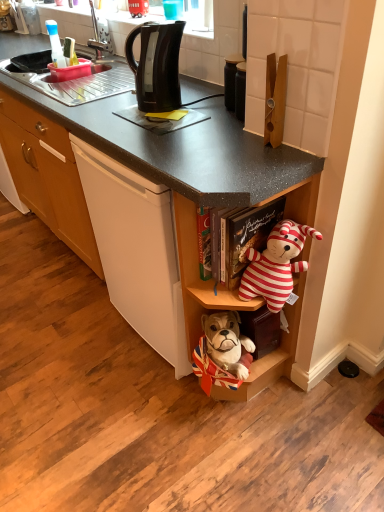
Question: Looking at their shapes, would you say striped fabric teddy bear at center-right is wider or thinner than black matte jar at upper center?

Choices:
 (A) thin
 (B) wide

Answer: (B)

Question: From a real-world perspective, relative to black matte jar at upper center, is striped fabric teddy bear at center-right vertically above or below?

Choices:
 (A) below
 (B) above

Answer: (A)

Question: Which is farther from the matte plastic sink at upper left?

Choices:
 (A) black plastic kettle at upper center
 (B) black plastic kettle at center
 (C) black matte jar at upper center
 (D) striped fabric teddy bear at center-right
 (E) wooden shelf at lower center

Answer: (D)

Question: Considering the real-world distances, which object is farthest from the black matte jar at upper center?

Choices:
 (A) matte plastic sink at upper left
 (B) black plastic kettle at center
 (C) striped fabric teddy bear at center-right
 (D) wooden shelf at lower center
 (E) black plastic kettle at upper center

Answer: (A)